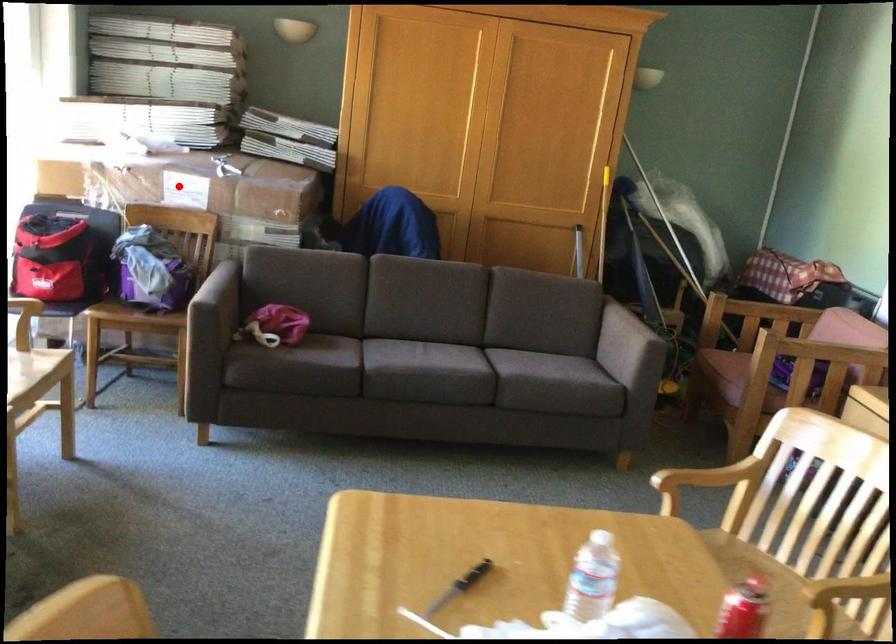
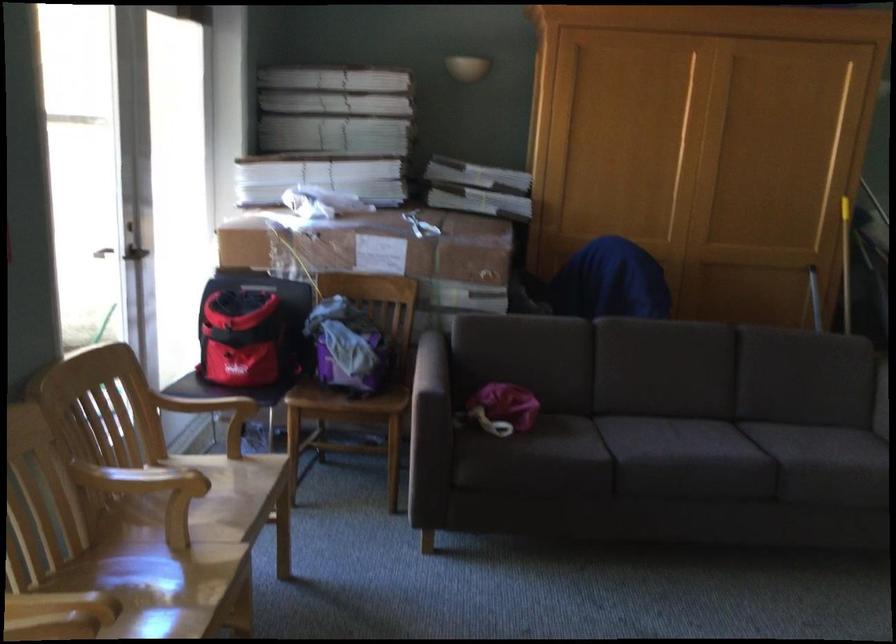
Question: I am providing you with two images of the same scene from different viewpoints. Given a red point in image1, look at the same physical point in image2. Is it:

Choices:
 (A) Closer to the viewpoint
 (B) Farther from the viewpoint

Answer: (A)